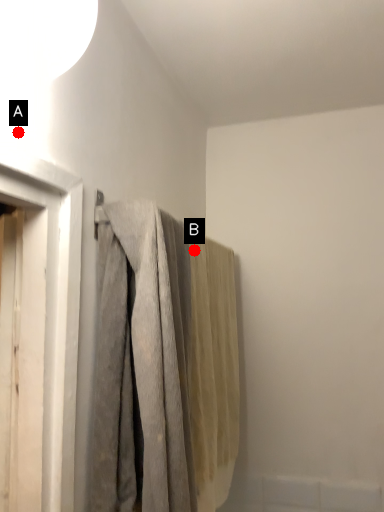
Question: Two points are circled on the image, labeled by A and B beside each circle. Which point is farther to the camera?

Choices:
 (A) A is further
 (B) B is further

Answer: (B)